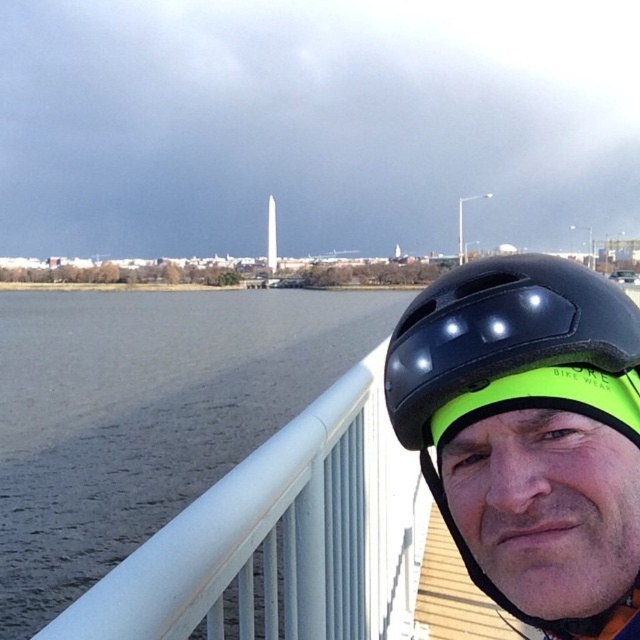
Question: Among these points, which one is farthest from the camera?

Choices:
 (A) (532, 563)
 (B) (156, 515)

Answer: (B)

Question: Does gray matte water at left appear on the left side of black matte helmet at upper right?

Choices:
 (A) no
 (B) yes

Answer: (B)

Question: Does gray matte water at left have a greater width compared to black matte helmet at upper right?

Choices:
 (A) yes
 (B) no

Answer: (A)

Question: Which of the following is the farthest from the observer?

Choices:
 (A) (227, 440)
 (B) (465, 320)

Answer: (A)

Question: Can you confirm if gray matte water at left is positioned to the right of black matte helmet at upper right?

Choices:
 (A) no
 (B) yes

Answer: (A)

Question: Which object appears farthest from the camera in this image?

Choices:
 (A) gray matte water at left
 (B) black matte helmet at upper right

Answer: (A)